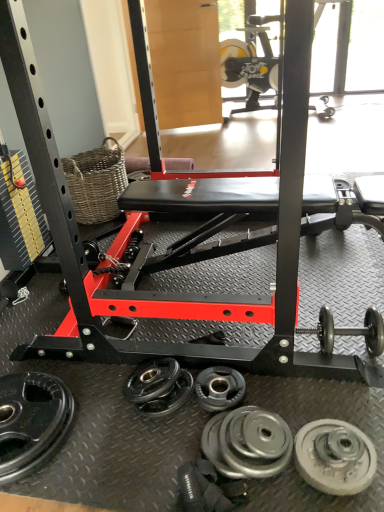
Question: Does silver metallic weight plate at lower center, which ranks as the third wheel in left-to-right order, have a greater width compared to polished silver dumbbell at lower right?

Choices:
 (A) yes
 (B) no

Answer: (B)

Question: Is silver metallic weight plate at lower center, which ranks as the third wheel in left-to-right order, thinner than polished silver dumbbell at lower right?

Choices:
 (A) no
 (B) yes

Answer: (B)

Question: Does silver metallic weight plate at lower center, the second wheel in the right-to-left sequence, come in front of polished silver dumbbell at lower right?

Choices:
 (A) yes
 (B) no

Answer: (A)

Question: Is silver metallic weight plate at lower center, the second wheel in the right-to-left sequence, directly adjacent to polished silver dumbbell at lower right?

Choices:
 (A) no
 (B) yes

Answer: (A)

Question: From a real-world perspective, is silver metallic weight plate at lower center, the second wheel in the right-to-left sequence, physically below polished silver dumbbell at lower right?

Choices:
 (A) no
 (B) yes

Answer: (B)

Question: Based on their positions, is polished silver dumbbell at lower right located to the left or right of black rubber weight plate at lower left, the first wheel positioned from the left?

Choices:
 (A) right
 (B) left

Answer: (A)

Question: From their relative heights in the image, would you say polished silver dumbbell at lower right is taller or shorter than black rubber weight plate at lower left, the 4th wheel from the right?

Choices:
 (A) tall
 (B) short

Answer: (A)

Question: Is polished silver dumbbell at lower right bigger or smaller than black rubber weight plate at lower left, the 4th wheel from the right?

Choices:
 (A) small
 (B) big

Answer: (B)

Question: From the image's perspective, is polished silver dumbbell at lower right located above or below black rubber weight plate at lower left, the 4th wheel from the right?

Choices:
 (A) above
 (B) below

Answer: (A)

Question: Relative to woven brown basket at upper left, is black rubber weight plate at center, the third wheel viewed from the right, in front or behind?

Choices:
 (A) behind
 (B) front

Answer: (B)

Question: From their relative heights in the image, would you say black rubber weight plate at center, the 2th wheel in the left-to-right sequence, is taller or shorter than woven brown basket at upper left?

Choices:
 (A) short
 (B) tall

Answer: (A)

Question: In the image, is black rubber weight plate at center, the third wheel viewed from the right, on the left side or the right side of woven brown basket at upper left?

Choices:
 (A) left
 (B) right

Answer: (B)

Question: From a real-world perspective, is black rubber weight plate at center, the third wheel viewed from the right, positioned above or below woven brown basket at upper left?

Choices:
 (A) below
 (B) above

Answer: (A)

Question: Relative to woven brown basket at upper left, is polished silver dumbbell at lower right in front or behind?

Choices:
 (A) front
 (B) behind

Answer: (A)

Question: Is polished silver dumbbell at lower right inside or outside of woven brown basket at upper left?

Choices:
 (A) outside
 (B) inside

Answer: (A)